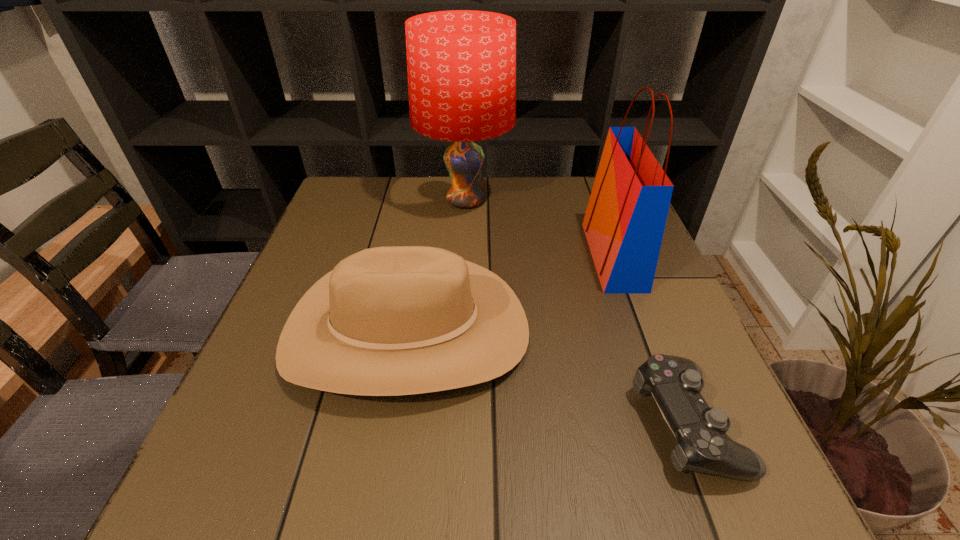
Where is `vacant region that satisfies the following two spatial constraints: 1. on the handle side of the shopping bag; 2. on the right side of the shortest object`? vacant region that satisfies the following two spatial constraints: 1. on the handle side of the shopping bag; 2. on the right side of the shortest object is located at coordinates (674, 423).

Find the location of `vacant area that satisfies the following two spatial constraints: 1. on the handle side of the shopping bag; 2. on the left side of the shortest object`. vacant area that satisfies the following two spatial constraints: 1. on the handle side of the shopping bag; 2. on the left side of the shortest object is located at coordinates (674, 423).

The height and width of the screenshot is (540, 960). I want to click on free location that satisfies the following two spatial constraints: 1. on the handle side of the shopping bag; 2. on the right side of the shortest object, so click(x=674, y=423).

This screenshot has width=960, height=540. What are the coordinates of `free spot that satisfies the following two spatial constraints: 1. on the handle side of the shopping bag; 2. on the front side of the second shortest object` in the screenshot? It's located at (640, 330).

The width and height of the screenshot is (960, 540). I want to click on free space that satisfies the following two spatial constraints: 1. on the front-facing side of the lampshade; 2. on the left side of the shortest object, so click(454, 423).